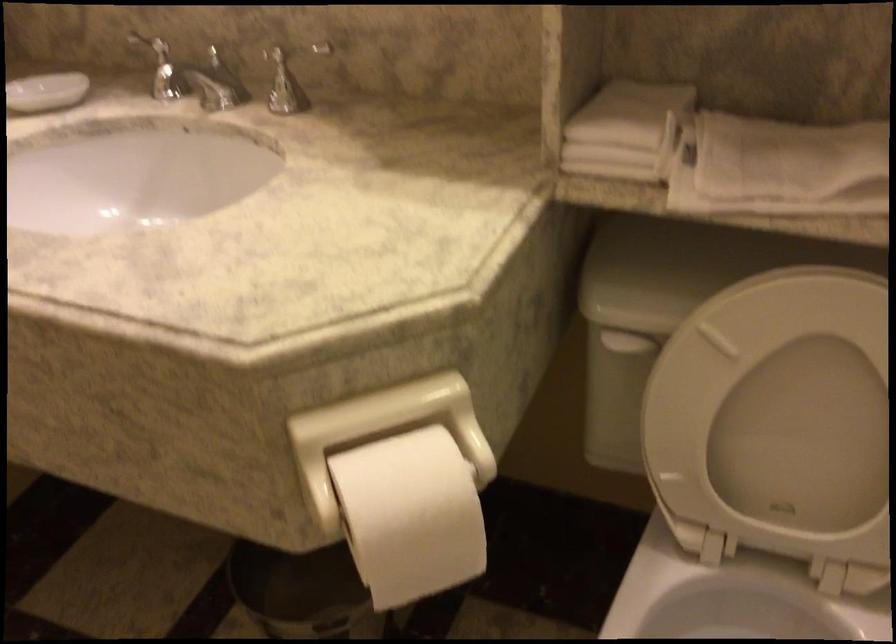
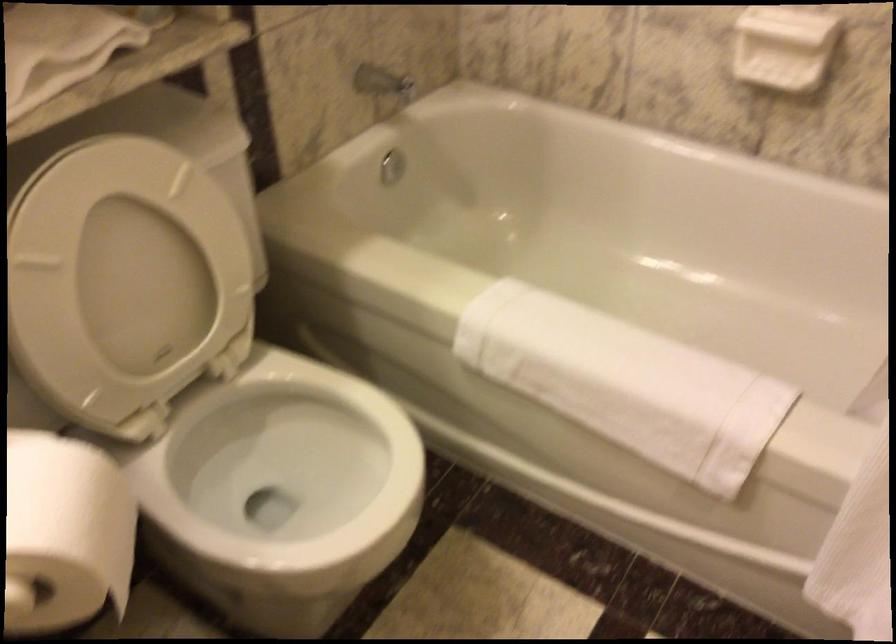
In the second image, find the point that corresponds to (x=820, y=402) in the first image.

(126, 266)